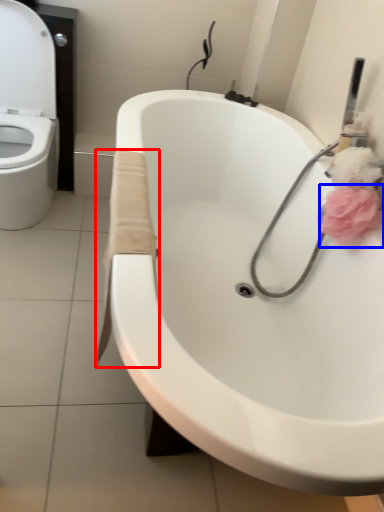
Question: Which object is further to the camera taking this photo, material (highlighted by a red box) or flower (highlighted by a blue box)?

Choices:
 (A) material
 (B) flower

Answer: (B)